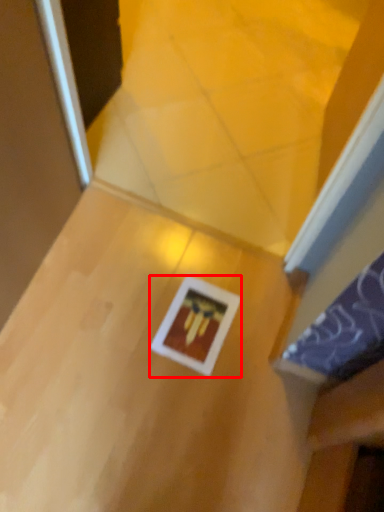
Question: From the image's perspective, where is picture frame (annotated by the red box) located relative to table?

Choices:
 (A) below
 (B) above

Answer: (B)